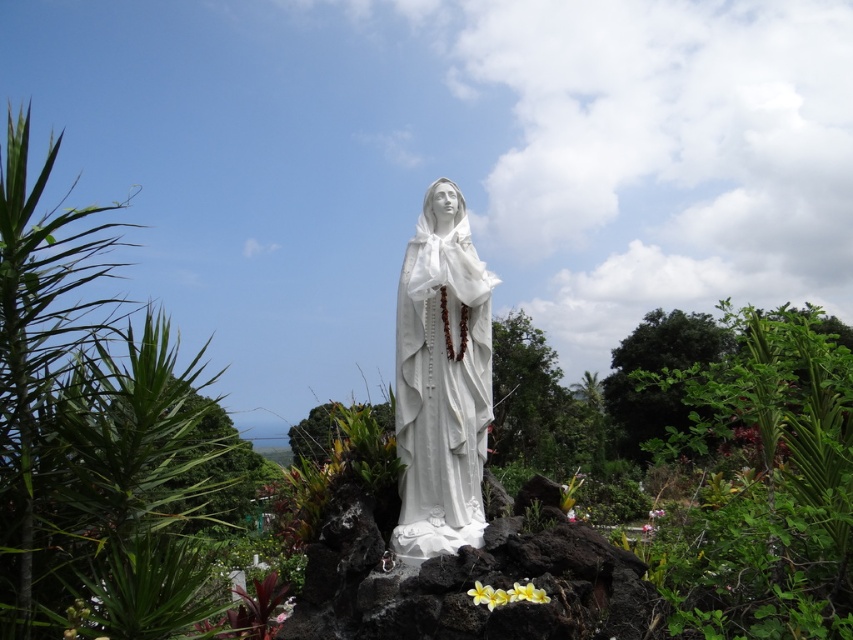
Question: Can you confirm if white marble statue at center is positioned below yellow matte flower at lower center?

Choices:
 (A) no
 (B) yes

Answer: (A)

Question: Which object appears farthest from the camera in this image?

Choices:
 (A) green leafy plant at center right
 (B) white marble statue at center

Answer: (B)

Question: Is green leafy plant at center right behind white matte flower at center?

Choices:
 (A) no
 (B) yes

Answer: (A)

Question: Which of the following is the closest to the observer?

Choices:
 (A) (790, 358)
 (B) (463, 268)
 (C) (662, 509)

Answer: (A)

Question: Which point is farther to the camera?

Choices:
 (A) (782, 477)
 (B) (651, 509)
 (C) (474, 589)
 (D) (451, 445)

Answer: (B)

Question: Can you confirm if green leafy plant at center right is bigger than yellow matte flower at lower center?

Choices:
 (A) no
 (B) yes

Answer: (B)